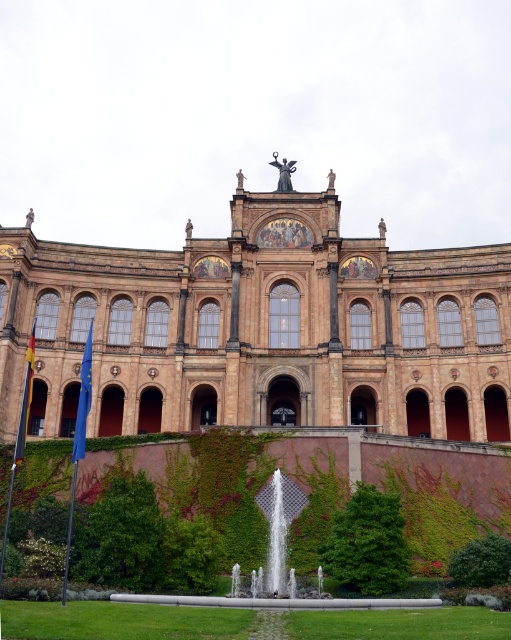
You are standing at the camera position and want to take a photo of the green leafy hedge at lower left. If your camera has a maximum zoom range of 50 meters, will you be able to capture the hedge clearly without moving closer?

The green leafy hedge at lower left and camera are 56.57 meters apart from each other, which exceeds the camera maximum zoom range of 50 meters. Therefore, you won not be able to capture the hedge clearly without moving closer.

You are standing at the entrance of the grand historic building and see the point labeled as point (122, 536). What object is located at that point?

The point (122, 536) corresponds to the green leafy hedge at lower left.

Based on the photo, you are standing on the lawn in front of the historic building and want to walk towards the green leafy hedge at lower right. Will you have to step over the clear glass water at center to reach it?

The clear glass water at center is above the green leafy hedge at lower right, so you would not need to step over it to reach the hedge since it is positioned above and not in your path.